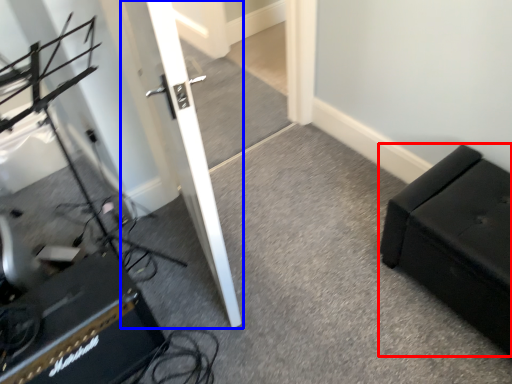
Question: Which point is closer to the camera, furniture (highlighted by a red box) or door (highlighted by a blue box)?

Choices:
 (A) furniture
 (B) door

Answer: (B)